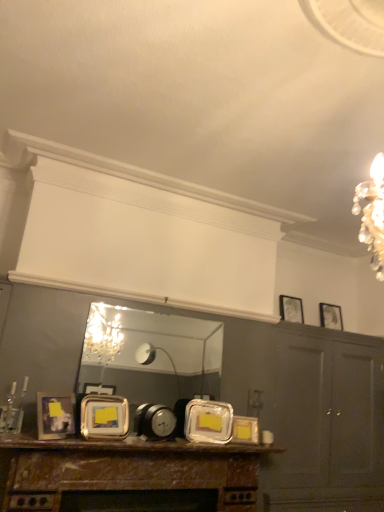
Question: Does metallic silver frame at center, acting as the second picture frame starting from the left, have a larger size compared to metallic reflective mirror at center?

Choices:
 (A) no
 (B) yes

Answer: (A)

Question: Is metallic silver frame at center, which appears as the fourth picture frame when viewed from the back, at the left side of metallic reflective mirror at center?

Choices:
 (A) no
 (B) yes

Answer: (B)

Question: From the image's perspective, does metallic silver frame at center, which appears as the fourth picture frame when viewed from the back, appear higher than metallic reflective mirror at center?

Choices:
 (A) no
 (B) yes

Answer: (A)

Question: Would you say metallic reflective mirror at center is part of metallic silver frame at center, which appears as the fourth picture frame when viewed from the back,'s contents?

Choices:
 (A) no
 (B) yes

Answer: (A)

Question: Considering the relative positions of metallic silver frame at center, acting as the 2th picture frame starting from the front, and metallic reflective mirror at center in the image provided, is metallic silver frame at center, acting as the 2th picture frame starting from the front, to the right of metallic reflective mirror at center from the viewer's perspective?

Choices:
 (A) no
 (B) yes

Answer: (A)

Question: Is metallic gold picture frame at center, arranged as the third picture frame when viewed from the left, not near metallic silver picture frame at upper right, the second picture frame in the right-to-left sequence?

Choices:
 (A) yes
 (B) no

Answer: (A)

Question: Considering the relative sizes of metallic gold picture frame at center, the 3th picture frame when ordered from front to back, and metallic silver picture frame at upper right, the second picture frame in the right-to-left sequence, in the image provided, is metallic gold picture frame at center, the 3th picture frame when ordered from front to back, thinner than metallic silver picture frame at upper right, the second picture frame in the right-to-left sequence,?

Choices:
 (A) no
 (B) yes

Answer: (A)

Question: Is metallic gold picture frame at center, the third picture frame in the right-to-left sequence, turned away from metallic silver picture frame at upper right, the second picture frame in the back-to-front sequence?

Choices:
 (A) no
 (B) yes

Answer: (A)

Question: Would you say metallic gold picture frame at center, the 3th picture frame when ordered from front to back, is outside metallic silver picture frame at upper right, the second picture frame in the right-to-left sequence?

Choices:
 (A) no
 (B) yes

Answer: (B)

Question: Could you tell me if metallic gold picture frame at center, which is the 3th picture frame from back to front, is turned towards metallic silver picture frame at upper right, which is the 4th picture frame in front-to-back order?

Choices:
 (A) yes
 (B) no

Answer: (B)

Question: Is metallic gold picture frame at center, the 3th picture frame when ordered from front to back, smaller than metallic silver picture frame at upper right, which is the 4th picture frame in front-to-back order?

Choices:
 (A) yes
 (B) no

Answer: (A)

Question: Is rustic wood mantel at lower center surrounding matte silver picture frame at upper right, the first picture frame in the back-to-front sequence?

Choices:
 (A) no
 (B) yes

Answer: (A)